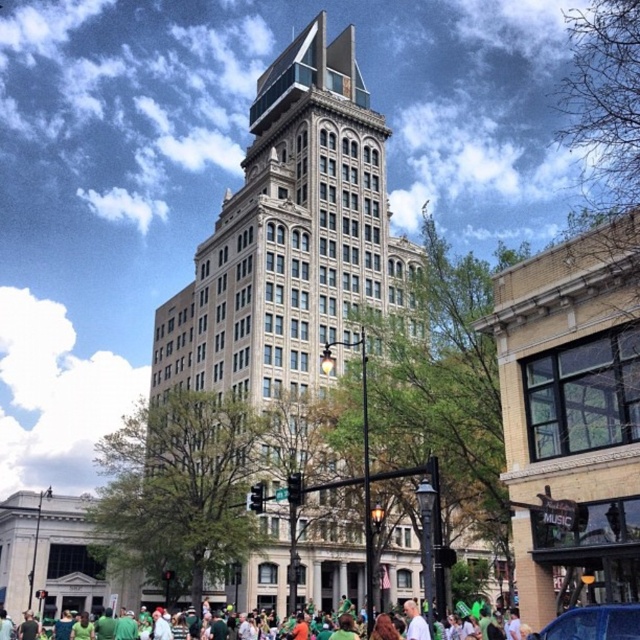
Who is lower down, beige stone building at center or shiny blue car at lower right?

shiny blue car at lower right

Who is more distant from viewer, (x=186, y=310) or (x=624, y=632)?

Positioned behind is point (x=186, y=310).

Find the location of `beige stone building at center`. beige stone building at center is located at coordinates (289, 236).

Between shiny blue car at lower right and green fabric crowd at lower center, which one has more height?

green fabric crowd at lower center

Can you confirm if shiny blue car at lower right is positioned to the left of green fabric crowd at lower center?

Incorrect, shiny blue car at lower right is not on the left side of green fabric crowd at lower center.

Is point (566, 621) more distant than point (298, 625)?

No, (566, 621) is closer to viewer.

At what (x,y) coordinates should I click in order to perform the action: click on shiny blue car at lower right. Please return your answer as a coordinate pair (x, y). The image size is (640, 640). Looking at the image, I should click on (593, 624).

Between beige stone building at center and green fabric crowd at lower center, which one has more height?

beige stone building at center is taller.

Is beige stone building at center to the right of green fabric crowd at lower center from the viewer's perspective?

In fact, beige stone building at center is to the left of green fabric crowd at lower center.

You are a GUI agent. You are given a task and a screenshot of the screen. Output one action in this format:
    pyautogui.click(x=<x>, y=<y>)
    Task: Click on the beige stone building at center
    The height and width of the screenshot is (640, 640).
    Given the screenshot: What is the action you would take?
    pyautogui.click(x=289, y=236)